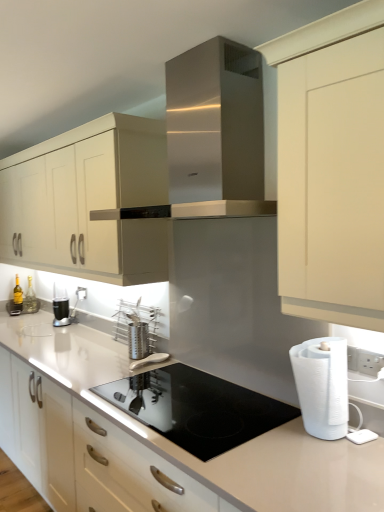
This screenshot has height=512, width=384. In order to click on vacant point above white matte paper towel at right (from a real-world perspective) in this screenshot , I will do `click(325, 343)`.